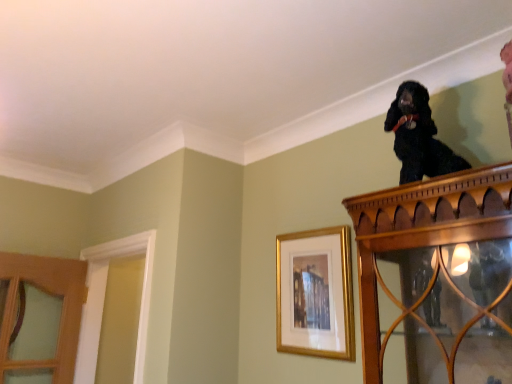
Question: Is gold framed picture at upper center not near black silky dog at upper right?

Choices:
 (A) yes
 (B) no

Answer: (B)

Question: Could you tell me if gold framed picture at upper center is turned towards black silky dog at upper right?

Choices:
 (A) yes
 (B) no

Answer: (B)

Question: Can you confirm if gold framed picture at upper center is shorter than black silky dog at upper right?

Choices:
 (A) no
 (B) yes

Answer: (A)

Question: Does gold framed picture at upper center have a greater width compared to black silky dog at upper right?

Choices:
 (A) yes
 (B) no

Answer: (B)

Question: Is gold framed picture at upper center smaller than black silky dog at upper right?

Choices:
 (A) yes
 (B) no

Answer: (A)

Question: Based on their sizes in the image, would you say white wood door frame at left is bigger or smaller than black silky dog at upper right?

Choices:
 (A) big
 (B) small

Answer: (A)

Question: Considering the positions of white wood door frame at left and black silky dog at upper right in the image, is white wood door frame at left wider or thinner than black silky dog at upper right?

Choices:
 (A) thin
 (B) wide

Answer: (B)

Question: Considering the positions of point [x=90, y=246] and point [x=397, y=119], is point [x=90, y=246] closer or farther from the camera than point [x=397, y=119]?

Choices:
 (A) farther
 (B) closer

Answer: (A)

Question: From the image's perspective, relative to black silky dog at upper right, is white wood door frame at left above or below?

Choices:
 (A) above
 (B) below

Answer: (B)

Question: Is black silky dog at upper right wider or thinner than gold framed picture at upper center?

Choices:
 (A) wide
 (B) thin

Answer: (A)

Question: Considering the relative positions of black silky dog at upper right and gold framed picture at upper center in the image provided, is black silky dog at upper right to the left or to the right of gold framed picture at upper center?

Choices:
 (A) left
 (B) right

Answer: (B)

Question: Is black silky dog at upper right bigger or smaller than gold framed picture at upper center?

Choices:
 (A) big
 (B) small

Answer: (A)

Question: Relative to gold framed picture at upper center, is black silky dog at upper right in front or behind?

Choices:
 (A) behind
 (B) front

Answer: (B)

Question: In terms of width, does white wood door frame at left look wider or thinner when compared to gold framed picture at upper center?

Choices:
 (A) thin
 (B) wide

Answer: (B)

Question: Considering the positions of point (145, 289) and point (350, 345), is point (145, 289) closer or farther from the camera than point (350, 345)?

Choices:
 (A) closer
 (B) farther

Answer: (B)